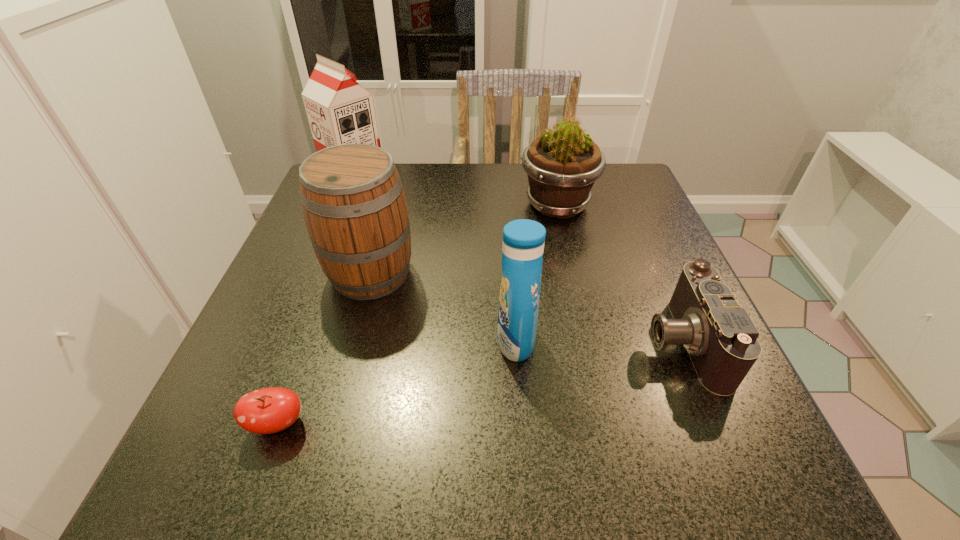
The width and height of the screenshot is (960, 540). Find the location of `vacant space located 0.070m on the right of the cider`. vacant space located 0.070m on the right of the cider is located at coordinates (449, 273).

Locate an element on the screen. This screenshot has height=540, width=960. free space located 0.330m on the front-facing side of the detergent is located at coordinates (304, 341).

The width and height of the screenshot is (960, 540). What are the coordinates of `free space located 0.370m on the front-facing side of the detergent` in the screenshot? It's located at (281, 341).

This screenshot has width=960, height=540. Identify the location of vacant space situated 0.180m on the front-facing side of the detergent. (392, 341).

Identify the location of free region located on the front-facing side of the rightmost object. The width and height of the screenshot is (960, 540). (442, 342).

Identify the location of free location located 0.240m on the front-facing side of the rightmost object. (506, 342).

Locate an element on the screen. Image resolution: width=960 pixels, height=540 pixels. free space located on the front-facing side of the rightmost object is located at coordinates (453, 342).

Locate an element on the screen. vacant space located 0.210m on the back of the shortest object is located at coordinates (322, 304).

This screenshot has height=540, width=960. Find the location of `soya milk that is at the far edge`. soya milk that is at the far edge is located at coordinates (340, 111).

In order to click on flowerpot that is at the far edge in this screenshot , I will do tap(562, 164).